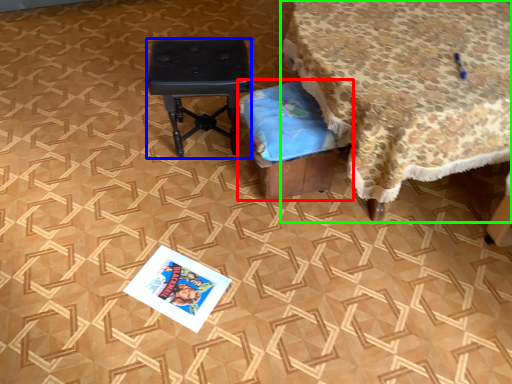
Question: Considering the real-world distances, which object is farthest from furniture (highlighted by a red box)? stool (highlighted by a blue box) or table (highlighted by a green box)?

Choices:
 (A) stool
 (B) table

Answer: (A)